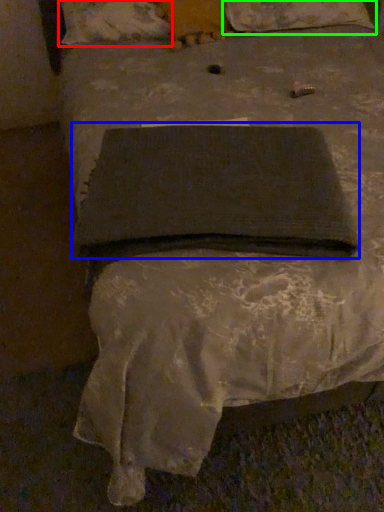
Question: Considering the real-world distances, which object is closest to pillow (highlighted by a red box)? pad (highlighted by a blue box) or pillow (highlighted by a green box).

Choices:
 (A) pad
 (B) pillow

Answer: (B)